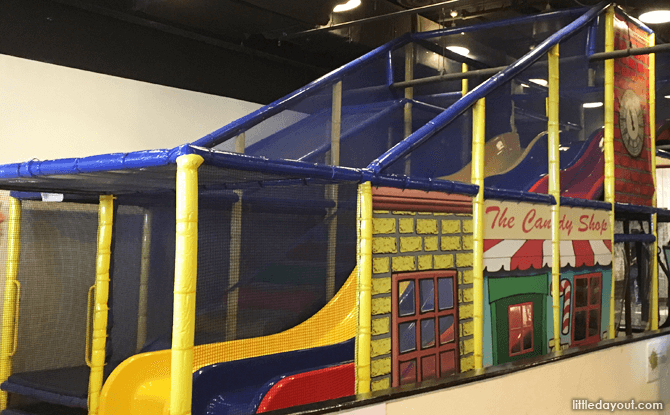
This screenshot has width=670, height=415. Find the location of `windows`. windows is located at coordinates (427, 325), (516, 329), (589, 315).